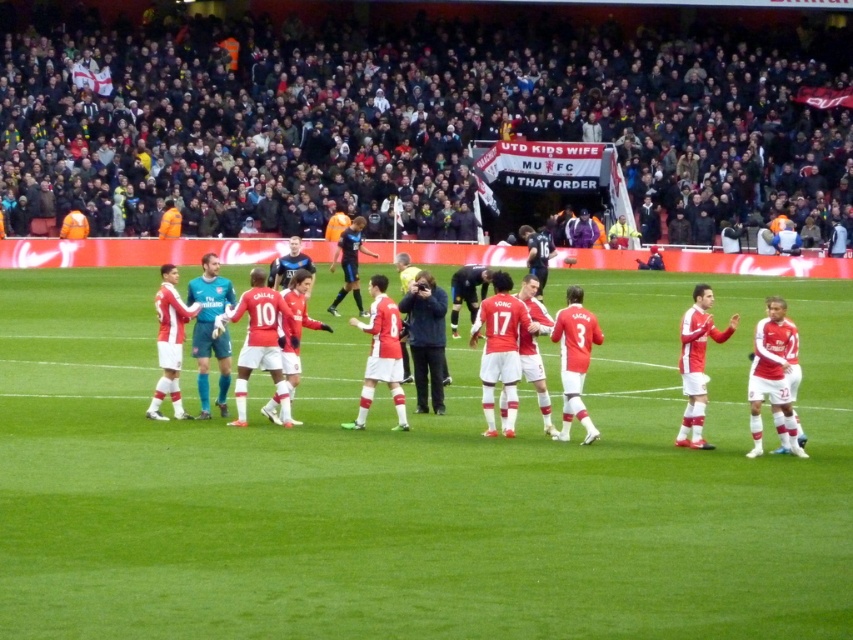
Question: Which point appears closest to the camera in this image?

Choices:
 (A) (428, 337)
 (B) (469, 275)
 (C) (700, 360)
 (D) (726, 172)

Answer: (C)

Question: Which point is farther to the camera?

Choices:
 (A) (479, 272)
 (B) (798, 513)
 (C) (788, 445)

Answer: (A)

Question: Is red matte soccer field at center below matte black camera at center?

Choices:
 (A) yes
 (B) no

Answer: (A)

Question: Is red matte soccer field at center positioned at the back of matte red jersey at center?

Choices:
 (A) no
 (B) yes

Answer: (A)

Question: Is red matte soccer field at center smaller than dark gray fabric crowd at upper center?

Choices:
 (A) no
 (B) yes

Answer: (B)

Question: Among these objects, which one is nearest to the camera?

Choices:
 (A) matte red jersey at center
 (B) dark gray fabric crowd at upper center

Answer: (A)